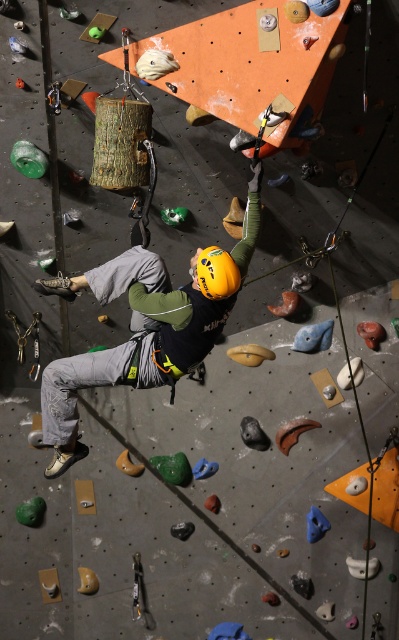
Is matte yellow helmet at center below yellow matte helmet at center?

Indeed, matte yellow helmet at center is positioned under yellow matte helmet at center.

Is matte yellow helmet at center taller than yellow matte helmet at center?

Indeed, matte yellow helmet at center has a greater height compared to yellow matte helmet at center.

Is point (100, 282) more distant than point (227, 273)?

Yes, point (100, 282) is farther from viewer.

This screenshot has height=640, width=399. I want to click on matte yellow helmet at center, so click(130, 342).